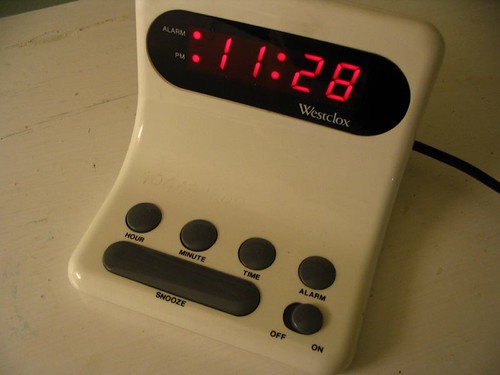
Locate an element on the screen. Image resolution: width=500 pixels, height=375 pixels. wood grains is located at coordinates (26, 127), (58, 117), (95, 104), (29, 42), (95, 23).